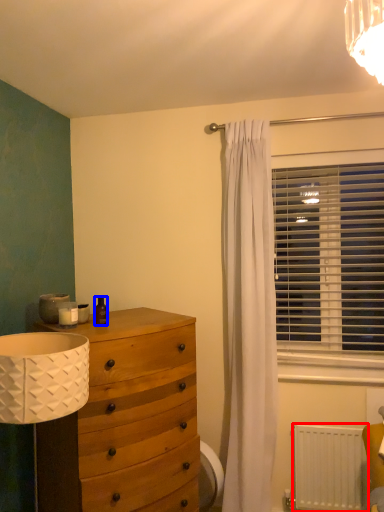
Question: Which of the following is the closest to the observer, radiator (highlighted by a red box) or toiletry (highlighted by a blue box)?

Choices:
 (A) radiator
 (B) toiletry

Answer: (B)